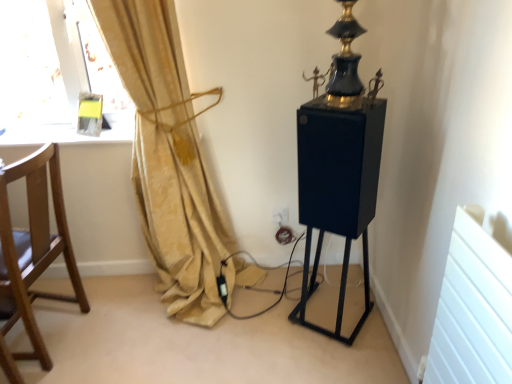
Image resolution: width=512 pixels, height=384 pixels. I want to click on free region under gold fabric curtain at left (from a real-world perspective), so click(221, 297).